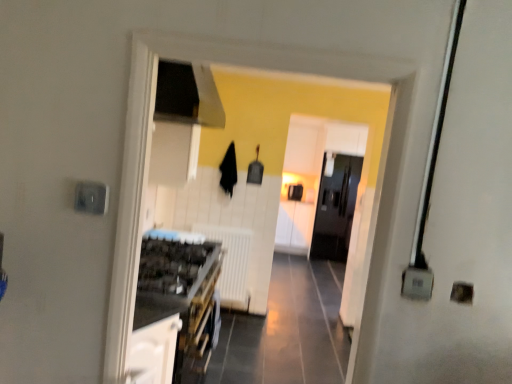
Question: Is white matte radiator at center at the right side of white glossy cabinet at lower left, which is counted as the second cabinetry, starting from the right?

Choices:
 (A) yes
 (B) no

Answer: (A)

Question: From a real-world perspective, is white matte radiator at center on top of white glossy cabinet at lower left, which is counted as the second cabinetry, starting from the right?

Choices:
 (A) yes
 (B) no

Answer: (B)

Question: From the image's perspective, does white matte radiator at center appear lower than white glossy cabinet at lower left, the second cabinetry positioned from the back?

Choices:
 (A) no
 (B) yes

Answer: (A)

Question: Is white matte radiator at center behind white glossy cabinet at lower left, the second cabinetry positioned from the back?

Choices:
 (A) yes
 (B) no

Answer: (A)

Question: From a real-world perspective, is white matte radiator at center beneath white glossy cabinet at lower left, which is the 1th cabinetry from front to back?

Choices:
 (A) no
 (B) yes

Answer: (B)

Question: In terms of size, does white glossy cabinet at center, the second cabinetry in the left-to-right sequence, appear bigger or smaller than white matte radiator at center?

Choices:
 (A) small
 (B) big

Answer: (B)

Question: From the image's perspective, is white glossy cabinet at center, which appears as the first cabinetry when viewed from the back, located above or below white matte radiator at center?

Choices:
 (A) above
 (B) below

Answer: (A)

Question: From their relative heights in the image, would you say white glossy cabinet at center, the second cabinetry in the left-to-right sequence, is taller or shorter than white matte radiator at center?

Choices:
 (A) tall
 (B) short

Answer: (A)

Question: Visually, is white glossy cabinet at center, the second cabinetry in the left-to-right sequence, positioned to the left or to the right of white matte radiator at center?

Choices:
 (A) left
 (B) right

Answer: (B)

Question: In the image, is white glossy cabinet at center, which appears as the first cabinetry when viewed from the back, positioned in front of or behind white glossy cabinet at lower left, positioned as the 1th cabinetry in left-to-right order?

Choices:
 (A) front
 (B) behind

Answer: (B)

Question: Choose the correct answer: Is white glossy cabinet at center, the second cabinetry in the left-to-right sequence, inside white glossy cabinet at lower left, which is counted as the second cabinetry, starting from the right, or outside it?

Choices:
 (A) inside
 (B) outside

Answer: (B)

Question: Looking at their shapes, would you say white glossy cabinet at center, the 1th cabinetry viewed from the right, is wider or thinner than white glossy cabinet at lower left, which is counted as the second cabinetry, starting from the right?

Choices:
 (A) wide
 (B) thin

Answer: (B)

Question: From the image's perspective, relative to white glossy cabinet at lower left, positioned as the 1th cabinetry in left-to-right order, is white glossy cabinet at center, the second cabinetry in the left-to-right sequence, above or below?

Choices:
 (A) below
 (B) above

Answer: (B)

Question: From the image's perspective, is white glossy cabinet at lower left, which is the 1th cabinetry from front to back, located above or below white matte radiator at center?

Choices:
 (A) above
 (B) below

Answer: (B)

Question: From their relative heights in the image, would you say white glossy cabinet at lower left, the second cabinetry positioned from the back, is taller or shorter than white matte radiator at center?

Choices:
 (A) short
 (B) tall

Answer: (A)